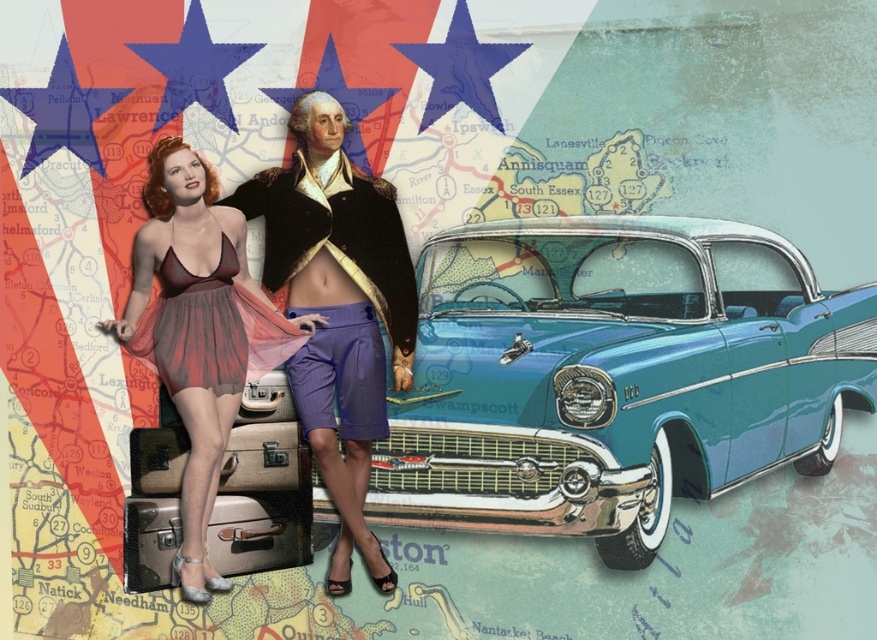
Question: From the image, what is the correct spatial relationship of matte red dress at center in relation to purple cotton shorts at center?

Choices:
 (A) right
 (B) left

Answer: (B)

Question: Among these points, which one is farthest from the camera?

Choices:
 (A) (x=169, y=260)
 (B) (x=269, y=428)
 (C) (x=279, y=340)

Answer: (B)

Question: Which object is farther from the camera taking this photo?

Choices:
 (A) metallic suitcase at center
 (B) matte red dress at center
 (C) matte purple bikini top at left

Answer: (A)

Question: Does pink sheer fabric at lower left have a greater width compared to matte purple bikini top at left?

Choices:
 (A) yes
 (B) no

Answer: (A)

Question: Which point is closer to the camera taking this photo?

Choices:
 (A) (177, 486)
 (B) (351, 166)
 (C) (464, 368)
 (D) (203, 336)

Answer: (D)

Question: Does matte red dress at center have a lesser width compared to purple cotton shorts at center?

Choices:
 (A) no
 (B) yes

Answer: (A)